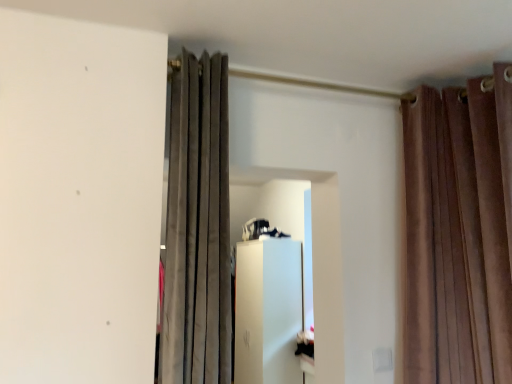
Question: From a real-world perspective, is suede curtain at center, which is counted as the second curtain, starting from the right, positioned above or below brown velvet curtains at upper right, placed as the 2th curtain when sorted from left to right?

Choices:
 (A) above
 (B) below

Answer: (A)

Question: From their relative heights in the image, would you say suede curtain at center, the 1th curtain viewed from the left, is taller or shorter than brown velvet curtains at upper right, placed as the 2th curtain when sorted from left to right?

Choices:
 (A) short
 (B) tall

Answer: (A)

Question: Is point (212, 120) positioned closer to the camera than point (411, 329)?

Choices:
 (A) closer
 (B) farther

Answer: (A)

Question: Is brown velvet curtains at upper right, placed as the 2th curtain when sorted from left to right, spatially inside suede curtain at center, which is counted as the second curtain, starting from the right, or outside of it?

Choices:
 (A) outside
 (B) inside

Answer: (A)

Question: From the image's perspective, is brown velvet curtains at upper right, which is the first curtain from right to left, above or below suede curtain at center, which is counted as the second curtain, starting from the right?

Choices:
 (A) below
 (B) above

Answer: (A)

Question: From a real-world perspective, relative to suede curtain at center, which is counted as the second curtain, starting from the right, is brown velvet curtains at upper right, placed as the 2th curtain when sorted from left to right, vertically above or below?

Choices:
 (A) below
 (B) above

Answer: (A)

Question: In the image, is brown velvet curtains at upper right, placed as the 2th curtain when sorted from left to right, on the left side or the right side of suede curtain at center, the 1th curtain viewed from the left?

Choices:
 (A) left
 (B) right

Answer: (B)